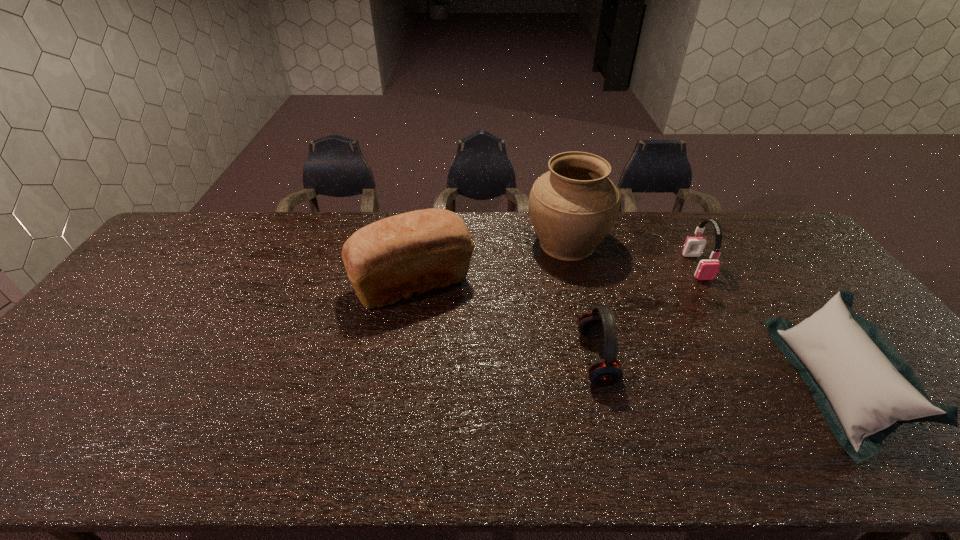
Locate an element on the screen. the tallest object is located at coordinates (573, 206).

Where is `the leftmost object`? This screenshot has height=540, width=960. the leftmost object is located at coordinates (414, 252).

Identify the location of bread. (414, 252).

Image resolution: width=960 pixels, height=540 pixels. I want to click on the fourth object from left to right, so click(x=707, y=269).

The image size is (960, 540). I want to click on the right earphone, so click(707, 269).

Locate an element on the screen. This screenshot has height=540, width=960. the nearer earphone is located at coordinates (x=606, y=372).

Identify the location of cushion. (865, 389).

The height and width of the screenshot is (540, 960). I want to click on free space located 0.370m on the right of the urn, so click(718, 244).

At what (x,y) coordinates should I click in order to perform the action: click on free spot located on the front of the second tallest object. Please return your answer as a coordinate pair (x, y). The image size is (960, 540). Looking at the image, I should click on (395, 394).

This screenshot has height=540, width=960. Identify the location of free point located 0.130m on the outer surface of the right earphone. (722, 312).